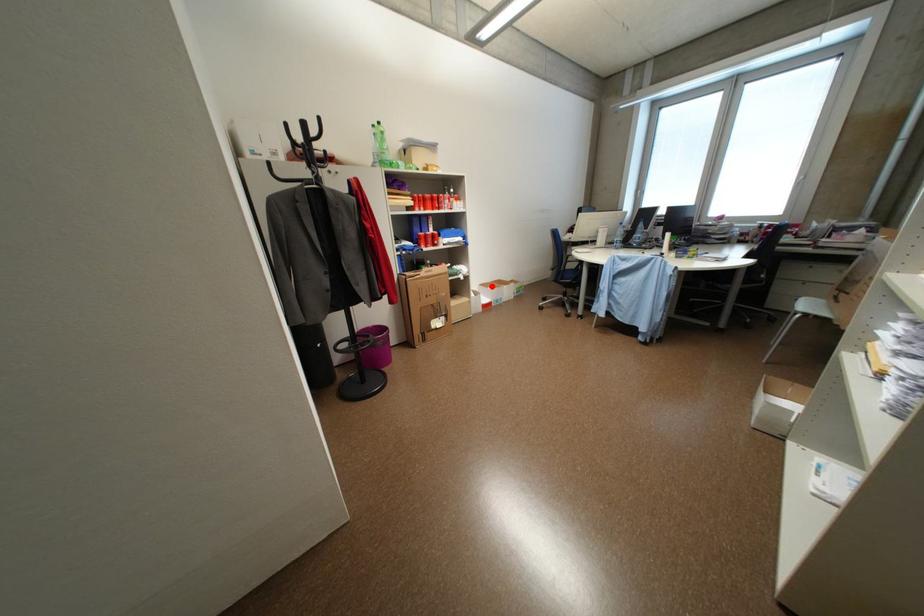
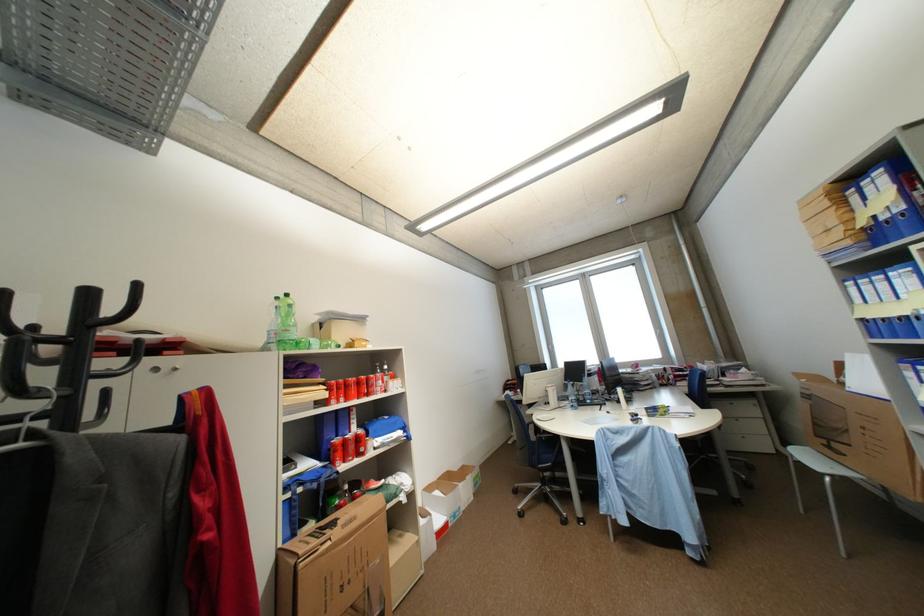
Question: I am providing you with two images of the same scene from different viewpoints. Given a red point in image1, look at the same physical point in image2. Is it:

Choices:
 (A) Closer to the viewpoint
 (B) Farther from the viewpoint

Answer: (B)